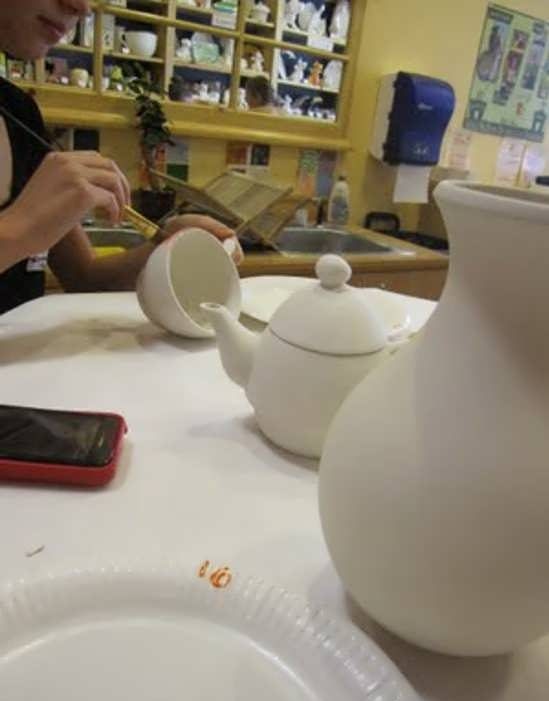
The width and height of the screenshot is (549, 701). In order to click on table in this screenshot , I will do `click(184, 463)`.